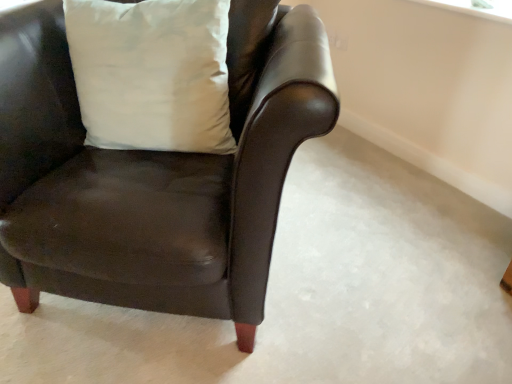
What is the approximate height of white matte pillow at upper left?

19.04 inches.

Where is `white matte pillow at upper left`? This screenshot has height=384, width=512. white matte pillow at upper left is located at coordinates (152, 74).

This screenshot has height=384, width=512. Describe the element at coordinates (152, 74) in the screenshot. I see `white matte pillow at upper left` at that location.

This screenshot has height=384, width=512. Describe the element at coordinates (154, 176) in the screenshot. I see `matte black armchair at center` at that location.

This screenshot has width=512, height=384. In order to click on matte black armchair at center in this screenshot , I will do `click(154, 176)`.

In the scene shown: Measure the distance between matte black armchair at center and camera.

matte black armchair at center is 32.54 inches away from camera.

Find the location of a particular element. This screenshot has height=384, width=512. white matte pillow at upper left is located at coordinates (152, 74).

Considering the positions of objects white matte pillow at upper left and matte black armchair at center in the image provided, who is more to the left, white matte pillow at upper left or matte black armchair at center?

white matte pillow at upper left.

Considering their positions, is white matte pillow at upper left located in front of or behind matte black armchair at center?

Visually, white matte pillow at upper left is located behind matte black armchair at center.

Is point (169, 70) behind point (284, 114)?

Yes, point (169, 70) is behind point (284, 114).

In the scene shown: From the image's perspective, relative to matte black armchair at center, is white matte pillow at upper left above or below?

white matte pillow at upper left is situated higher than matte black armchair at center in the image.

From a real-world perspective, does white matte pillow at upper left stand above matte black armchair at center?

Indeed, from a real-world perspective, white matte pillow at upper left stands above matte black armchair at center.

Does white matte pillow at upper left have a greater width compared to matte black armchair at center?

Incorrect, the width of white matte pillow at upper left does not surpass that of matte black armchair at center.

Consider the image. Considering the relative sizes of white matte pillow at upper left and matte black armchair at center in the image provided, is white matte pillow at upper left taller than matte black armchair at center?

No.

Between white matte pillow at upper left and matte black armchair at center, which one has larger size?

matte black armchair at center.

Is white matte pillow at upper left outside of matte black armchair at center?

No, white matte pillow at upper left is not entirely external to matte black armchair at center.

Is white matte pillow at upper left not close to matte black armchair at center?

No.

Is white matte pillow at upper left aimed at matte black armchair at center?

A: Yes, white matte pillow at upper left is oriented towards matte black armchair at center.

Measure the distance from white matte pillow at upper left to matte black armchair at center.

8.33 inches.

The height and width of the screenshot is (384, 512). What are the coordinates of `pillow located above the matte black armchair at center (from the image's perspective)` in the screenshot? It's located at (152, 74).

Considering the relative positions of matte black armchair at center and white matte pillow at upper left in the image provided, is matte black armchair at center to the left of white matte pillow at upper left from the viewer's perspective?

Incorrect, matte black armchair at center is not on the left side of white matte pillow at upper left.

Does matte black armchair at center come in front of white matte pillow at upper left?

Yes, the depth of matte black armchair at center is less than that of white matte pillow at upper left.

Between point (48, 287) and point (109, 146), which one is positioned in front?

Point (48, 287)

From the image's perspective, between matte black armchair at center and white matte pillow at upper left, which one is located above?

white matte pillow at upper left.

From a real-world perspective, between matte black armchair at center and white matte pillow at upper left, who is vertically lower?

matte black armchair at center is physically lower.

Can you confirm if matte black armchair at center is wider than white matte pillow at upper left?

Indeed, matte black armchair at center has a greater width compared to white matte pillow at upper left.

Who is taller, matte black armchair at center or white matte pillow at upper left?

matte black armchair at center is taller.

Who is smaller, matte black armchair at center or white matte pillow at upper left?

Smaller between the two is white matte pillow at upper left.

Is white matte pillow at upper left completely or partially inside matte black armchair at center?

Yes, white matte pillow at upper left can be found within matte black armchair at center.

Is matte black armchair at center next to white matte pillow at upper left and touching it?

No, matte black armchair at center is not beside white matte pillow at upper left.

Is matte black armchair at center oriented away from white matte pillow at upper left?

Yes.

How different are the orientations of matte black armchair at center and white matte pillow at upper left in degrees?

The angular difference between matte black armchair at center and white matte pillow at upper left is 6.99e-05 degrees.

Locate an element on the screen. The height and width of the screenshot is (384, 512). pillow to the left of matte black armchair at center is located at coordinates (152, 74).

At what (x,y) coordinates should I click in order to perform the action: click on pillow above the matte black armchair at center (from a real-world perspective). Please return your answer as a coordinate pair (x, y). This screenshot has width=512, height=384. Looking at the image, I should click on (152, 74).

The image size is (512, 384). I want to click on chair located in front of the white matte pillow at upper left, so click(x=154, y=176).